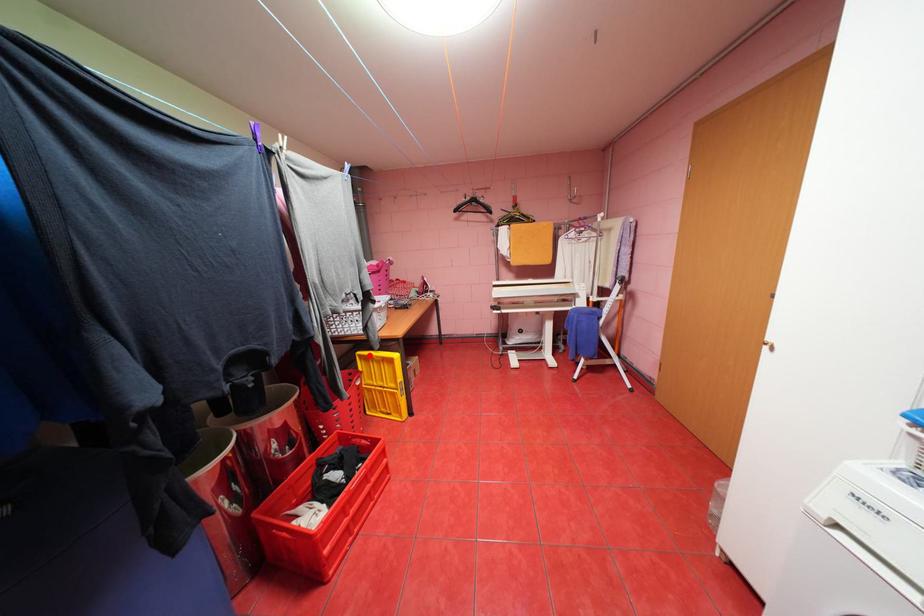
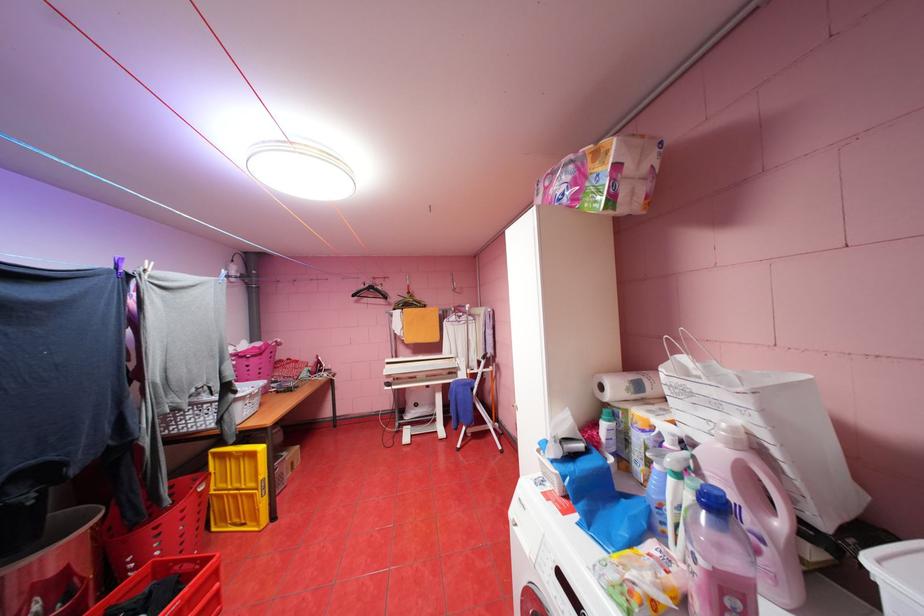
Question: I am providing you with two images of the same scene from different viewpoints. Given a red point in image1, look at the same physical point in image2. Is it:

Choices:
 (A) Closer to the viewpoint
 (B) Farther from the viewpoint

Answer: (B)